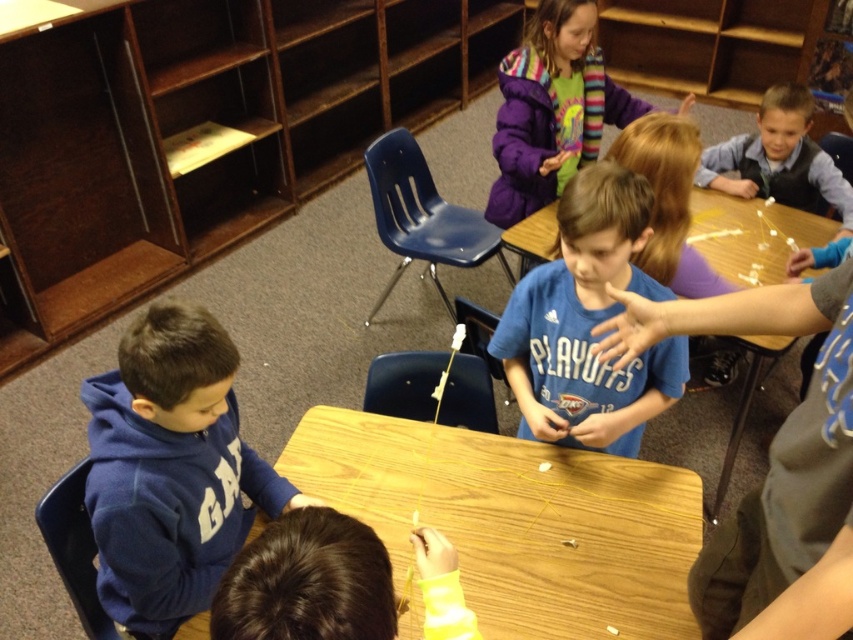
Question: Can you confirm if wooden bookshelf at left is positioned above blue fleece hoodie at lower left?

Choices:
 (A) yes
 (B) no

Answer: (A)

Question: Based on their relative distances, which object is nearer to the wooden table at center?

Choices:
 (A) dark brown hair at lower center
 (B) purple fleece jacket at upper center
 (C) light blue shirt at upper right

Answer: (A)

Question: Can you confirm if purple fleece jacket at upper center is positioned above light blue shirt at upper right?

Choices:
 (A) yes
 (B) no

Answer: (A)

Question: Which object appears farthest from the camera in this image?

Choices:
 (A) blue fleece hoodie at lower left
 (B) light blue shirt at upper right
 (C) dark brown hair at lower center
 (D) wooden bookshelf at left

Answer: (D)

Question: Which object appears farthest from the camera in this image?

Choices:
 (A) blue fleece hoodie at lower left
 (B) blue cotton shirt at center
 (C) purple fleece jacket at upper center

Answer: (C)

Question: Is blue fleece hoodie at lower left smaller than blue cotton shirt at center?

Choices:
 (A) no
 (B) yes

Answer: (A)